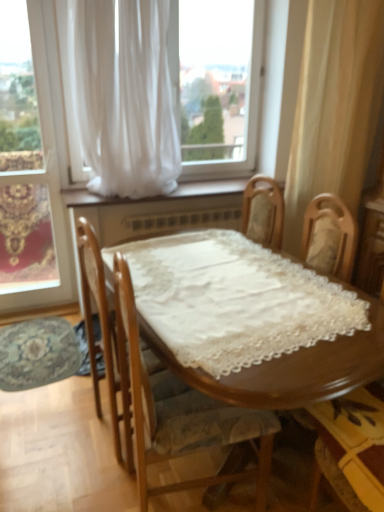
Question: Is wooden chair with lace cushion at center, which is the 2th chair from right to left, looking in the opposite direction of white sheer curtain at upper center, which appears as the first curtain when viewed from the left?

Choices:
 (A) yes
 (B) no

Answer: (B)

Question: Is white sheer curtain at upper center, which appears as the first curtain when viewed from the left, completely or partially inside wooden chair with lace cushion at center, which ranks as the first chair in left-to-right order?

Choices:
 (A) no
 (B) yes

Answer: (A)

Question: Can you confirm if wooden chair with lace cushion at center, which ranks as the first chair in left-to-right order, is taller than white sheer curtain at upper center, the 2th curtain positioned from the right?

Choices:
 (A) yes
 (B) no

Answer: (B)

Question: Considering the relative sizes of wooden chair with lace cushion at center, which is the 2th chair from right to left, and white sheer curtain at upper center, which appears as the first curtain when viewed from the left, in the image provided, is wooden chair with lace cushion at center, which is the 2th chair from right to left, smaller than white sheer curtain at upper center, which appears as the first curtain when viewed from the left,?

Choices:
 (A) no
 (B) yes

Answer: (B)

Question: Are wooden chair with lace cushion at center, which is the 2th chair from right to left, and white sheer curtain at upper center, the 2th curtain positioned from the right, located far from each other?

Choices:
 (A) no
 (B) yes

Answer: (B)

Question: Is wooden chair with lace cushion at center, which is the 2th chair from right to left, positioned in front of white sheer curtain at upper center, which appears as the first curtain when viewed from the left?

Choices:
 (A) yes
 (B) no

Answer: (A)

Question: Is white sheer curtain at upper center, which appears as the first curtain when viewed from the left, at the back of wooden chair at lower right, arranged as the 1th chair when viewed from the right?

Choices:
 (A) no
 (B) yes

Answer: (A)

Question: Is wooden chair at lower right, the 2th chair positioned from the left, positioned beyond the bounds of white sheer curtain at upper center, the 2th curtain positioned from the right?

Choices:
 (A) no
 (B) yes

Answer: (B)

Question: From a real-world perspective, is wooden chair at lower right, arranged as the 1th chair when viewed from the right, physically above white sheer curtain at upper center, the 2th curtain positioned from the right?

Choices:
 (A) yes
 (B) no

Answer: (B)

Question: Does wooden chair at lower right, arranged as the 1th chair when viewed from the right, have a larger size compared to white sheer curtain at upper center, the 2th curtain positioned from the right?

Choices:
 (A) yes
 (B) no

Answer: (B)

Question: Is wooden chair at lower right, the 2th chair positioned from the left, facing towards white sheer curtain at upper center, which appears as the first curtain when viewed from the left?

Choices:
 (A) no
 (B) yes

Answer: (A)

Question: Does wooden chair at lower right, arranged as the 1th chair when viewed from the right, have a greater height compared to white sheer curtain at upper center, the 2th curtain positioned from the right?

Choices:
 (A) no
 (B) yes

Answer: (A)

Question: Is white sheer curtain at upper center, which appears as the first curtain when viewed from the left, further to camera compared to wooden chair at lower right, the 2th chair positioned from the left?

Choices:
 (A) yes
 (B) no

Answer: (A)